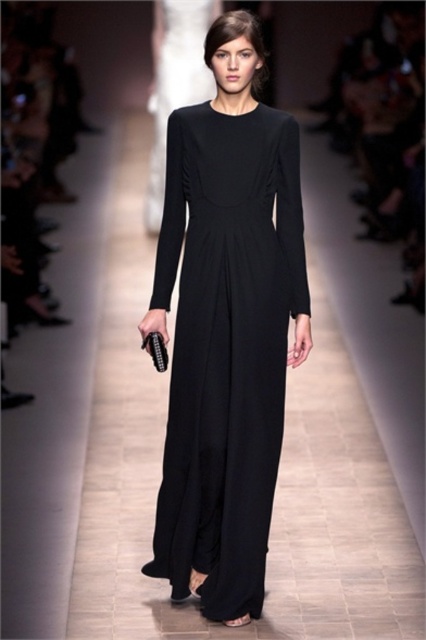
Looking at this image, you are a fashion designer observing the runway show. You notice two dresses labeled as the black matte dress at center and the matte black dress at center. Which dress is narrower in width?

The black matte dress at center is narrower in width than the matte black dress at center.

You are a photographer positioned at the center of the runway. You want to take a picture of the black matte dress at center. What is the exact 2D coordinate where you should focus your camera?

The black matte dress at center is located at the 2D coordinate point of [226,346], so you should focus your camera there.